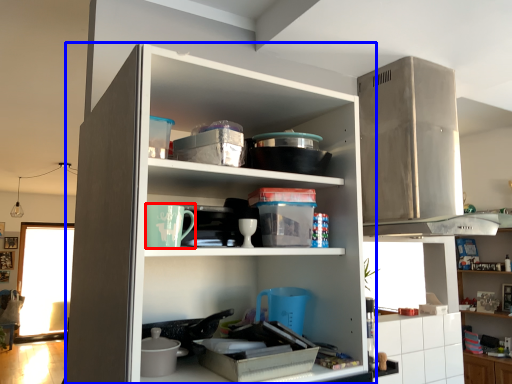
Question: Which point is closer to the camera, appliance (highlighted by a red box) or cupboard (highlighted by a blue box)?

Choices:
 (A) appliance
 (B) cupboard

Answer: (B)